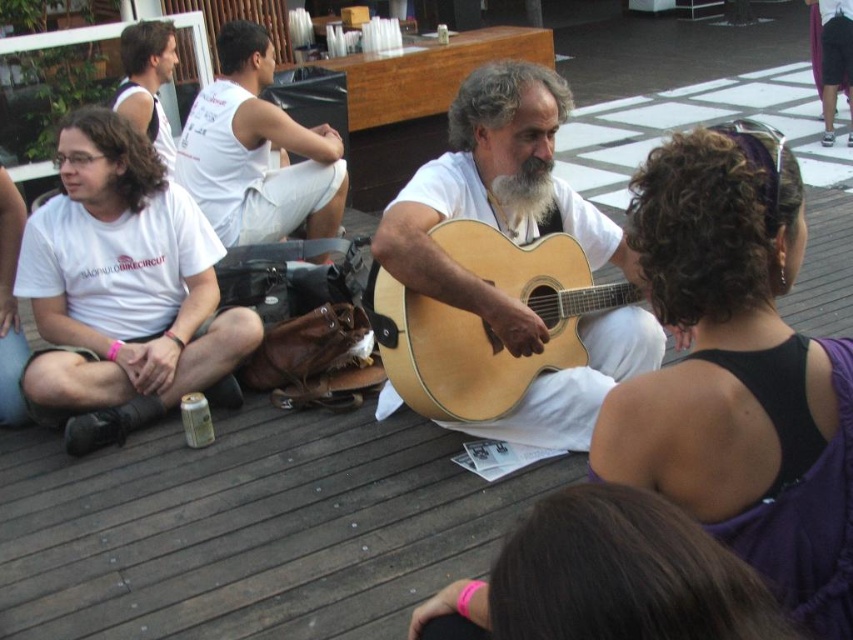
You are standing at the edge of the gathering and want to greet the person wearing the white cotton shirt at upper left and the white cotton tank top at upper left. Which one can you reach first without moving your position?

The white cotton shirt at upper left is closer to the viewer than the white cotton tank top at upper left, so you can reach the white cotton shirt at upper left first without moving your position.